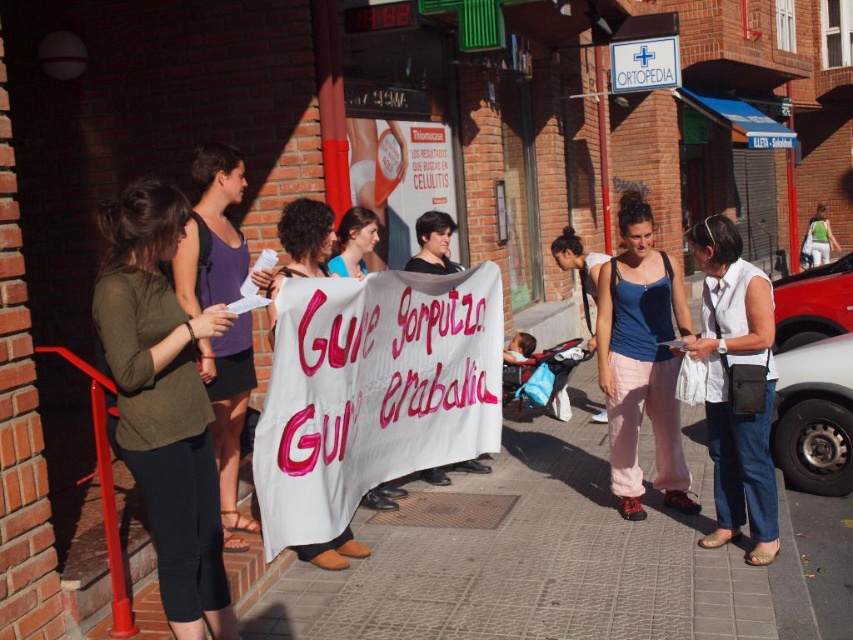
From the picture: Is white paper banner at center closer to the viewer compared to white plastic sign at upper center?

Yes, it is.

Locate an element on the screen. This screenshot has height=640, width=853. white paper banner at center is located at coordinates (306, 237).

At what (x,y) coordinates should I click in order to perform the action: click on white paper banner at center. Please return your answer as a coordinate pair (x, y). The image size is (853, 640). Looking at the image, I should click on (306, 237).

Does dark green jersey at center appear on the right side of white paper banner at center?

Incorrect, dark green jersey at center is not on the right side of white paper banner at center.

Is dark green jersey at center bigger than white paper banner at center?

Indeed, dark green jersey at center has a larger size compared to white paper banner at center.

Who is more distant from viewer, (169, 220) or (300, 225)?

Positioned behind is point (300, 225).

The image size is (853, 640). In order to click on dark green jersey at center in this screenshot , I will do `click(164, 403)`.

Does matte blue tank top at center have a larger size compared to white paper banner at center?

Yes.

Which is in front, point (651, 339) or point (323, 243)?

Point (323, 243)

Find the location of a particular element. The height and width of the screenshot is (640, 853). matte blue tank top at center is located at coordinates [641, 360].